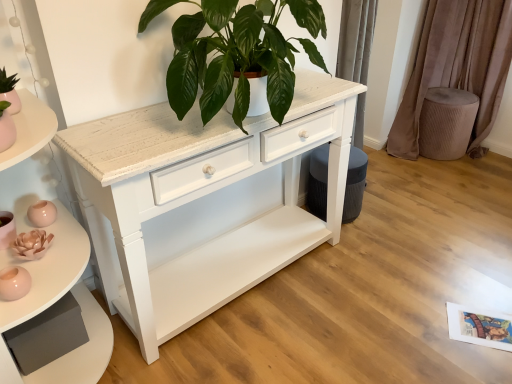
The width and height of the screenshot is (512, 384). I want to click on vacant space underneath green matte plant at center (from a real-world perspective), so click(276, 292).